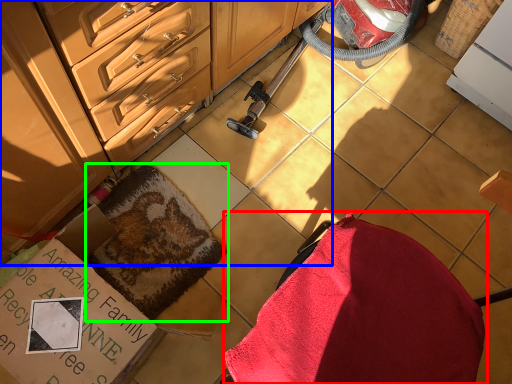
Question: Which object is positioned farthest from swivel chair (highlighted by a red box)? Select from cabinetry (highlighted by a blue box) and blanket (highlighted by a green box).

Choices:
 (A) cabinetry
 (B) blanket

Answer: (A)